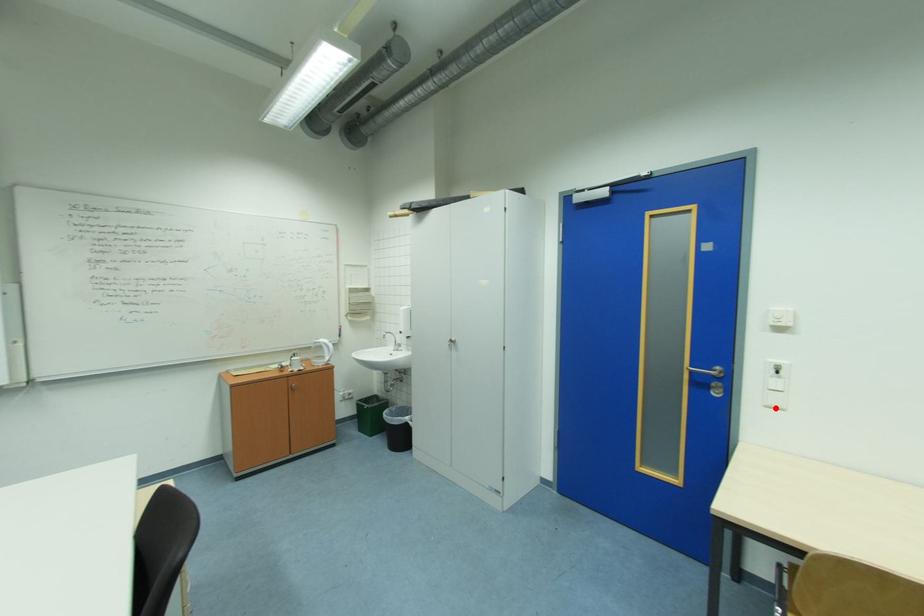
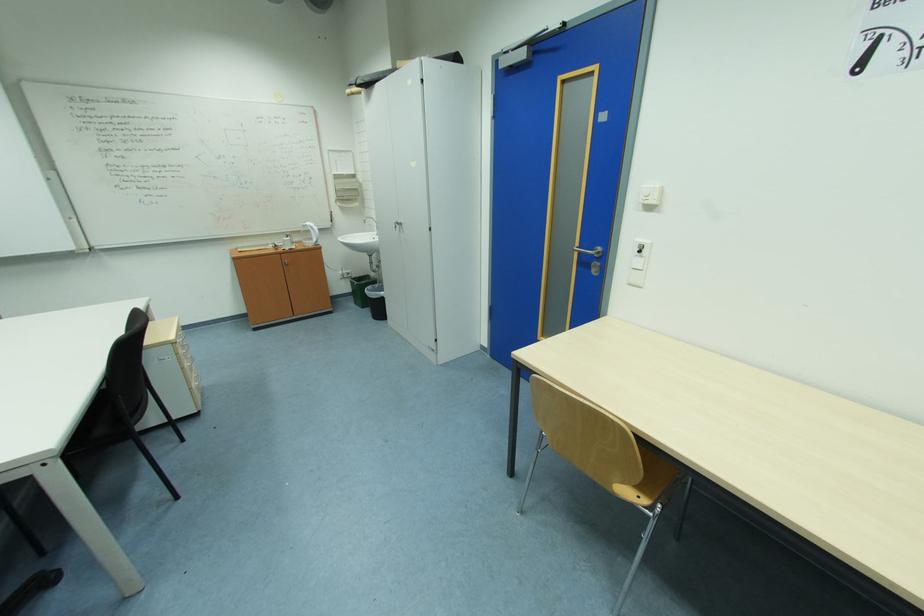
Question: I am providing you with two images of the same scene from different viewpoints. A red point is marked on the first image. Is the red point's position out of view in image 2?

Choices:
 (A) Yes
 (B) No

Answer: (B)